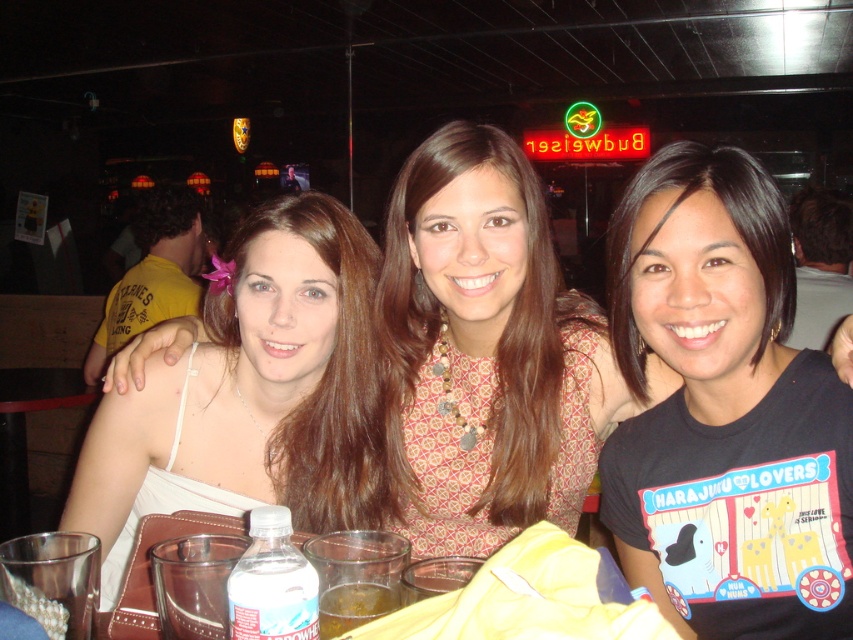
You are a bartender who needs to place a 2.5 inch wide coaster between the translucent glass cup at center and the translucent plastic cup at lower center. Can you fit the coaster between them without moving the cups?

The distance between the translucent glass cup at center and the translucent plastic cup at lower center is 1.67 inches, which is smaller than the coaster width of 2.5 inches. Therefore, the coaster cannot fit between them without moving the cups.